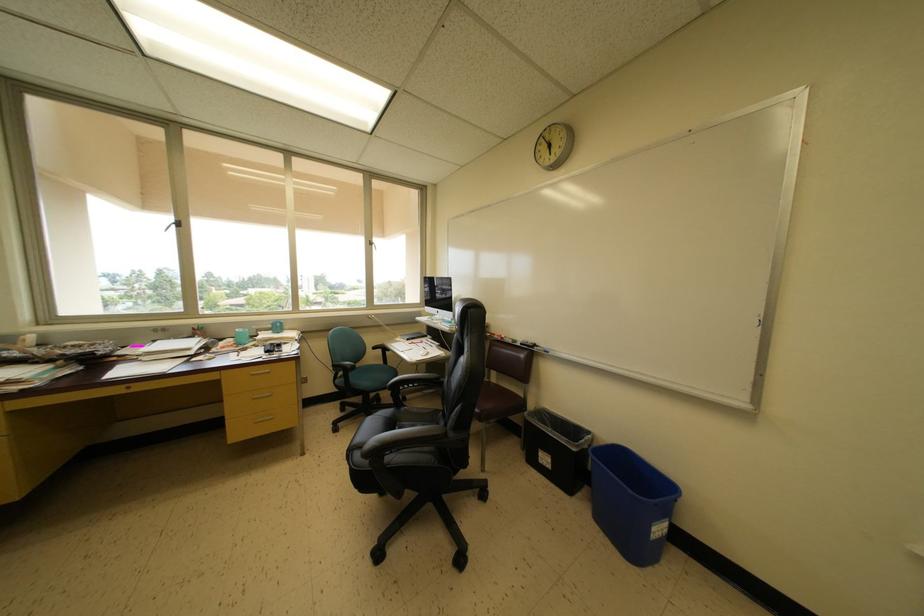
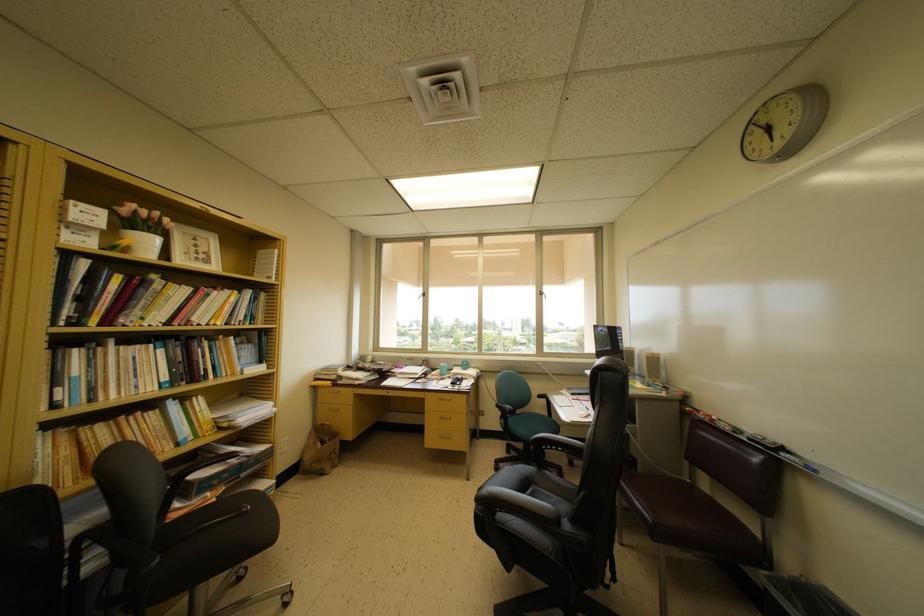
In the second image, find the point that corresponds to (373,246) in the first image.

(543, 297)